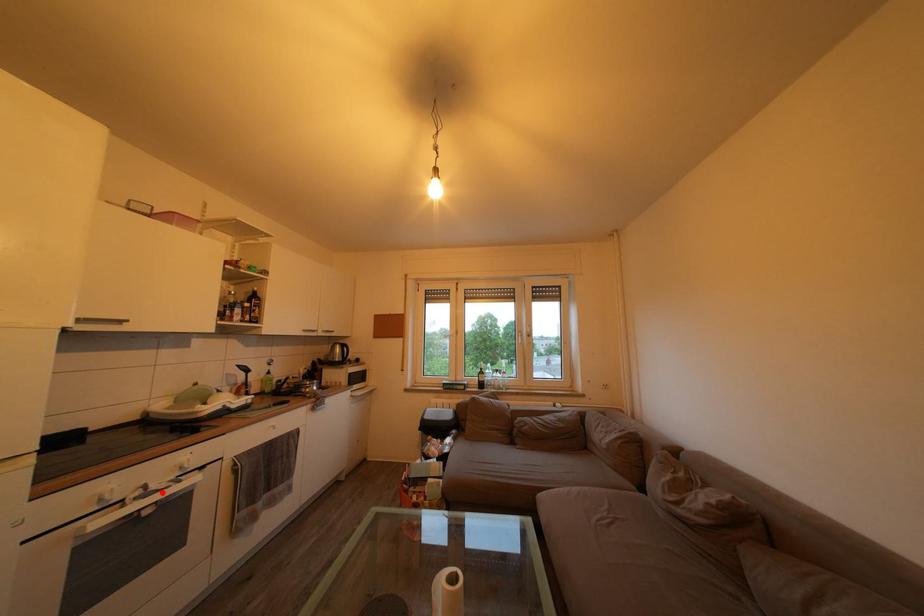
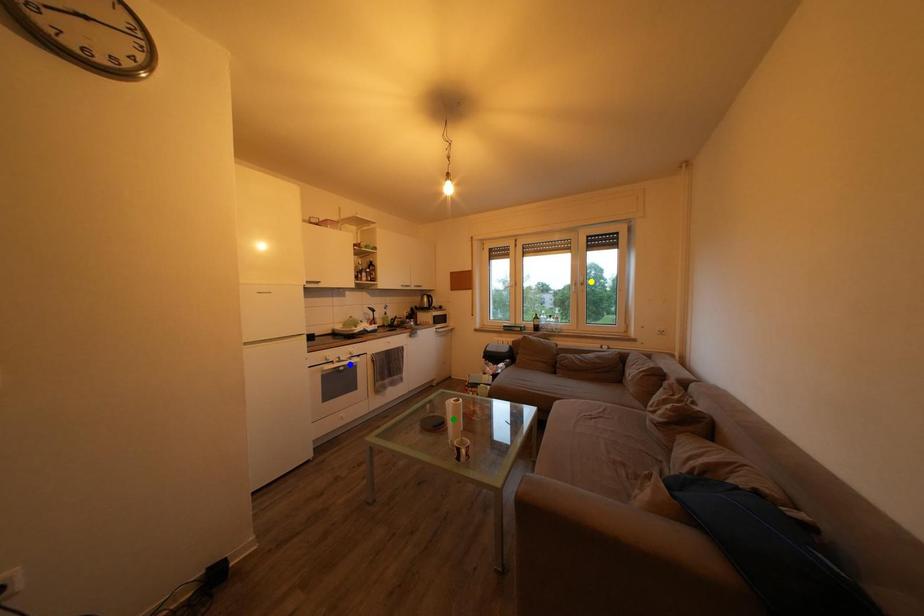
Question: I am providing you with two images of the same scene from different viewpoints. A red point is marked on the first image. You are given multiple points on the second image. Which point in image 2 represents the same 3d spot as the red point in image 1?

Choices:
 (A) blue point
 (B) green point
 (C) yellow point

Answer: (A)